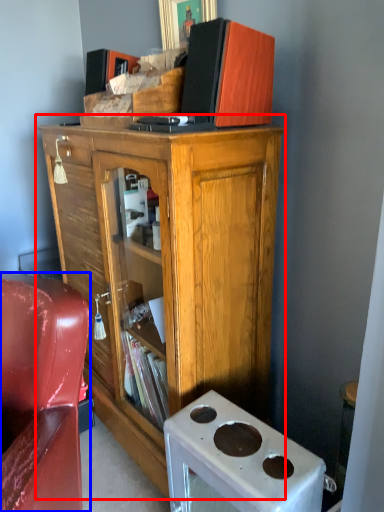
Question: Among these objects, which one is nearest to the camera, cabinetry (highlighted by a red box) or chair (highlighted by a blue box)?

Choices:
 (A) cabinetry
 (B) chair

Answer: (B)